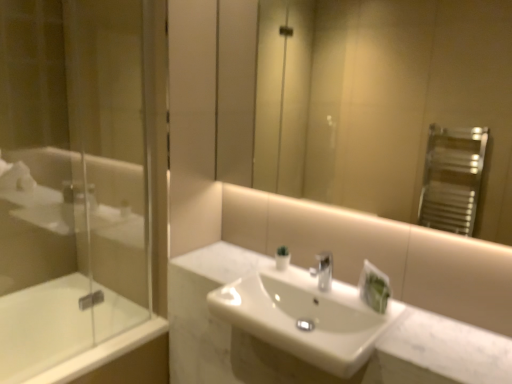
Identify the location of vacant space underneath transparent glass shower door at left (from a real-world perspective). The image size is (512, 384). (93, 346).